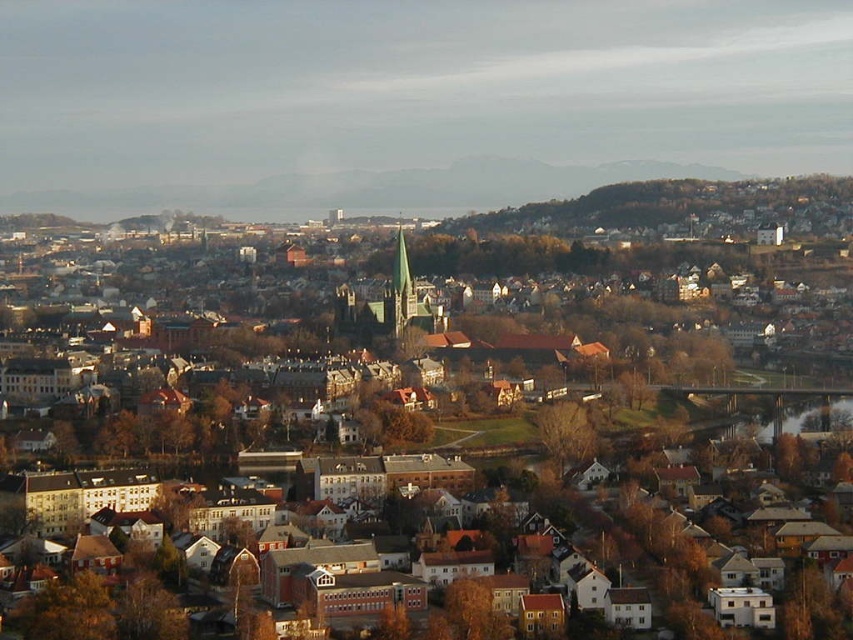
Between brown textured tree at lower left and green stone church steeple at center, which one appears on the right side from the viewer's perspective?

green stone church steeple at center

Does brown textured tree at lower left appear under green stone church steeple at center?

Indeed, brown textured tree at lower left is positioned under green stone church steeple at center.

The height and width of the screenshot is (640, 853). What do you see at coordinates (67, 611) in the screenshot?
I see `brown textured tree at lower left` at bounding box center [67, 611].

Image resolution: width=853 pixels, height=640 pixels. In order to click on brown textured tree at lower left in this screenshot , I will do `click(67, 611)`.

Looking at this image, does brown textured tree at lower left appear over brown leafy tree at center?

Incorrect, brown textured tree at lower left is not positioned above brown leafy tree at center.

Is brown textured tree at lower left to the right of brown leafy tree at center from the viewer's perspective?

In fact, brown textured tree at lower left is to the left of brown leafy tree at center.

Is point (28, 630) behind point (589, 419)?

No, it is not.

The height and width of the screenshot is (640, 853). Find the location of `brown textured tree at lower left`. brown textured tree at lower left is located at coordinates (67, 611).

Which is behind, point (102, 589) or point (415, 305)?

Point (415, 305)

Does brown textured tree at lower left appear on the left side of green stone spire at center?

Correct, you'll find brown textured tree at lower left to the left of green stone spire at center.

Is point (33, 620) closer to viewer compared to point (415, 300)?

Yes.

Where is `brown textured tree at lower left`? Image resolution: width=853 pixels, height=640 pixels. brown textured tree at lower left is located at coordinates (67, 611).